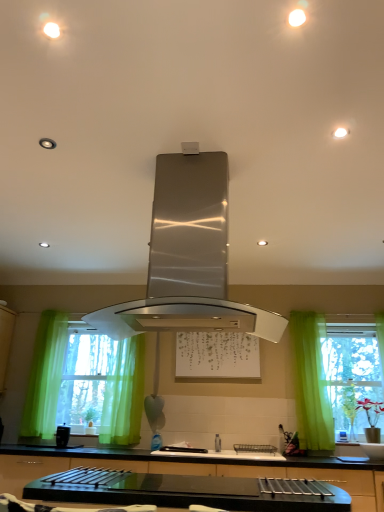
What are the coordinates of `free point below white matte bulletin board at center (from a real-world perspective)` in the screenshot? It's located at (224, 444).